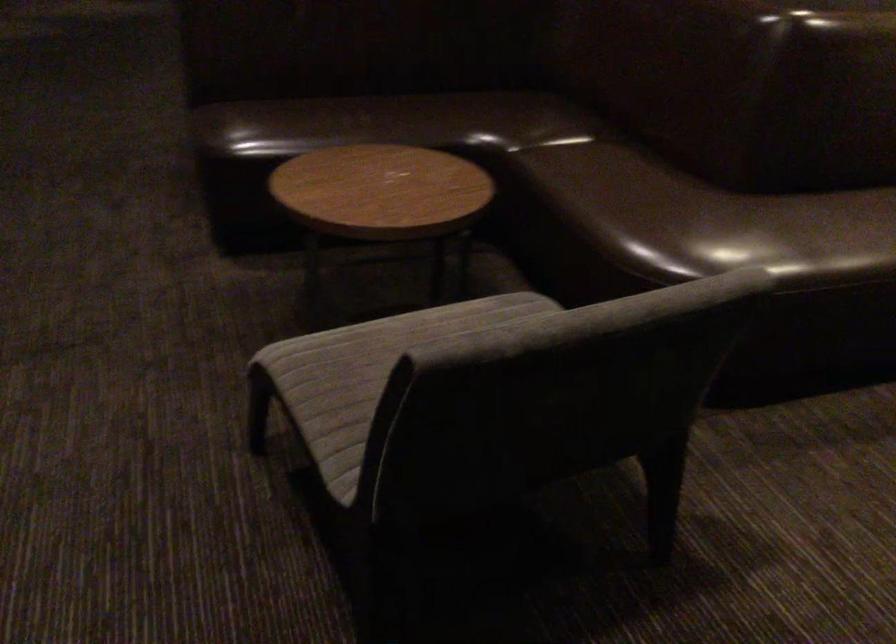
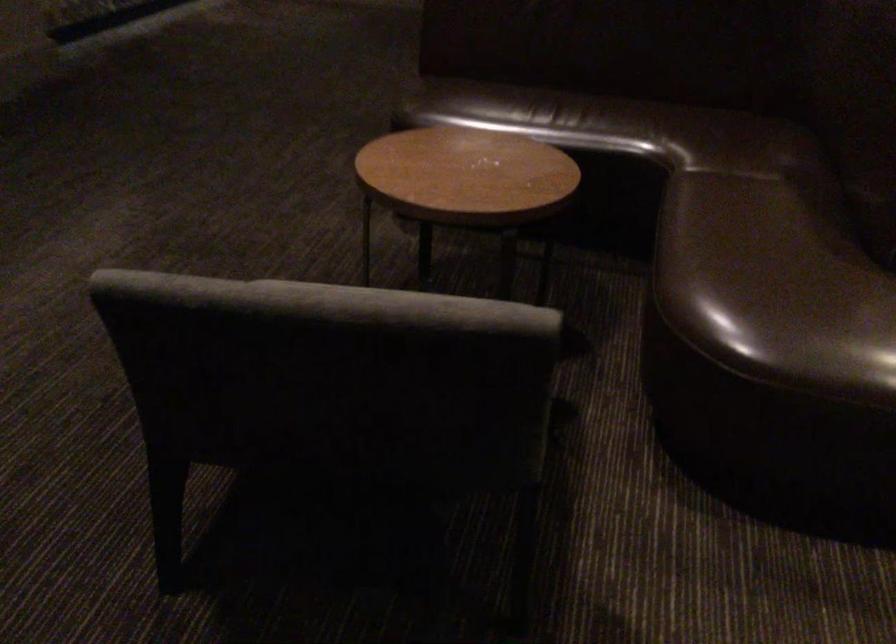
Find the pixel in the second image that matches (x=687, y=214) in the first image.

(772, 276)